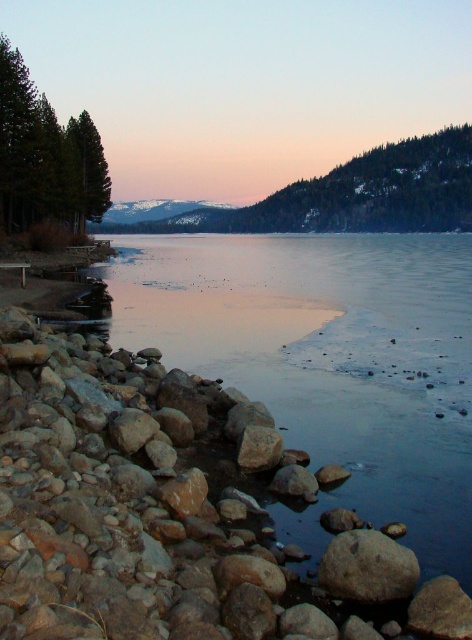
Question: Which of the following is the closest to the observer?

Choices:
 (A) (0, 227)
 (B) (230, 598)
 (C) (187, 202)

Answer: (B)

Question: Does green matte tree at left have a greater width compared to snowy mountain at center?

Choices:
 (A) yes
 (B) no

Answer: (B)

Question: Can you confirm if green matte tree at left is thinner than snowy mountain at center?

Choices:
 (A) no
 (B) yes

Answer: (B)

Question: Which point is farther to the camera?

Choices:
 (A) (166, 216)
 (B) (35, 182)

Answer: (A)

Question: Considering the real-world distances, which object is farthest from the green textured tree at upper right?

Choices:
 (A) brown rock at lower left
 (B) green matte tree at left
 (C) snowy mountain at center

Answer: (A)

Question: Considering the relative positions of green textured tree at upper right and snowy mountain at center in the image provided, where is green textured tree at upper right located with respect to snowy mountain at center?

Choices:
 (A) above
 (B) below

Answer: (A)